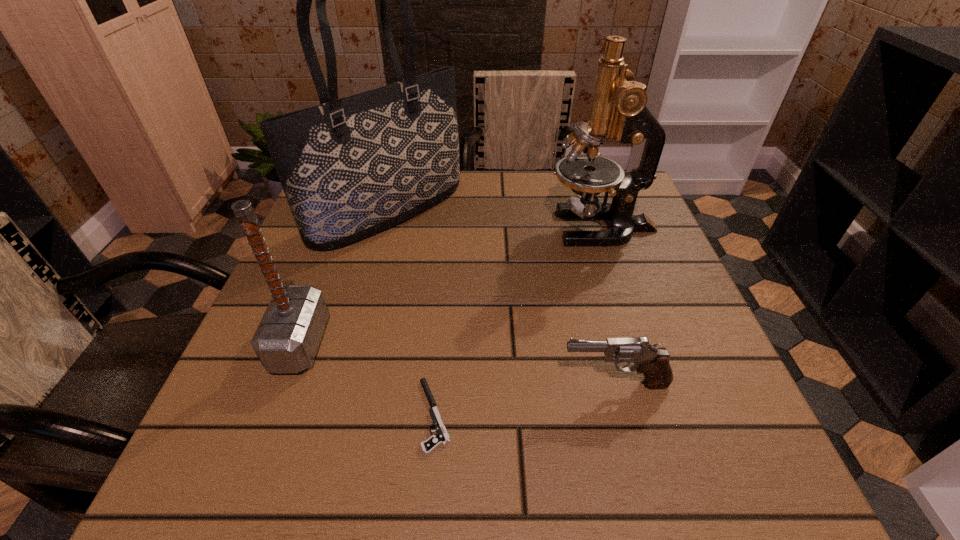
What are the coordinates of `empty space that is in between the hammer and the second tallest object` in the screenshot? It's located at (450, 286).

At what (x,y) coordinates should I click in order to perform the action: click on free spot between the left pistol and the right pistol. Please return your answer as a coordinate pair (x, y). The image size is (960, 540). Looking at the image, I should click on (524, 400).

Locate which object is the closest to the right pistol. Please provide its 2D coordinates. Your answer should be formatted as a tuple, i.e. [(x, y)], where the tuple contains the x and y coordinates of a point satisfying the conditions above.

[(441, 437)]

The height and width of the screenshot is (540, 960). What are the coordinates of `object that stands as the closest to the tote bag` in the screenshot? It's located at (287, 338).

Locate an element on the screen. Image resolution: width=960 pixels, height=540 pixels. free spot that satisfies the following two spatial constraints: 1. on the front side of the tallest object; 2. on the striking surface of the hammer is located at coordinates (353, 343).

Identify the location of blank area in the image that satisfies the following two spatial constraints: 1. on the front side of the tallest object; 2. on the striking surface of the third tallest object. (353, 343).